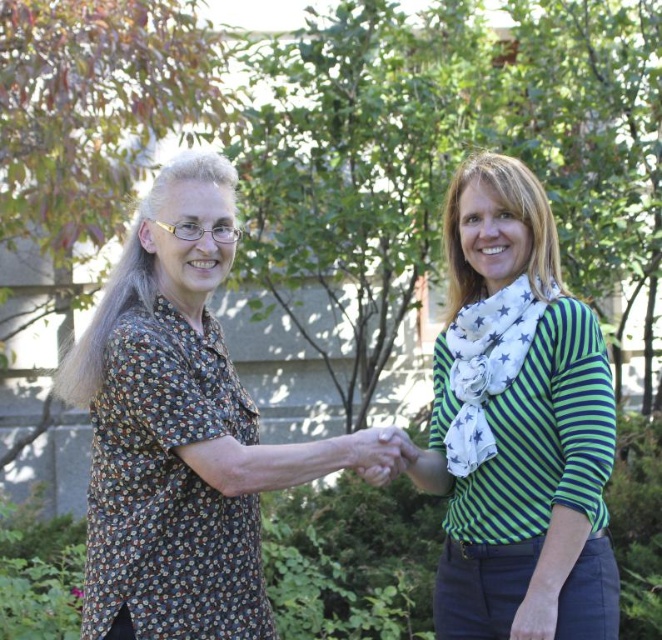
Question: Which point is closer to the camera taking this photo?

Choices:
 (A) coord(563,381)
 (B) coord(207,561)

Answer: (A)

Question: Among these points, which one is nearest to the camera?

Choices:
 (A) (201, 595)
 (B) (575, 490)

Answer: (B)

Question: Considering the relative positions of brown floral shirt at left and smooth skin hand at center in the image provided, where is brown floral shirt at left located with respect to smooth skin hand at center?

Choices:
 (A) above
 (B) below

Answer: (A)

Question: Can you confirm if brown floral shirt at left is wider than smooth skin hand at center?

Choices:
 (A) no
 (B) yes

Answer: (B)

Question: Which of these objects is positioned closest to the smooth skin hand at center?

Choices:
 (A) brown floral shirt at left
 (B) green striped shirt at center

Answer: (B)

Question: Does brown floral shirt at left appear over green striped shirt at center?

Choices:
 (A) no
 (B) yes

Answer: (B)